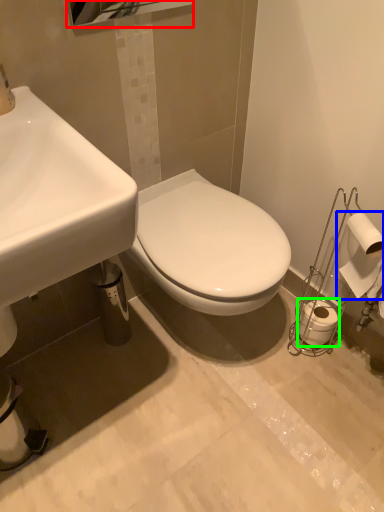
Question: Estimate the real-world distances between objects in this image. Which object is closer to mirror (highlighted by a red box), toilet paper (highlighted by a blue box) or toilet paper (highlighted by a green box)?

Choices:
 (A) toilet paper
 (B) toilet paper

Answer: (A)